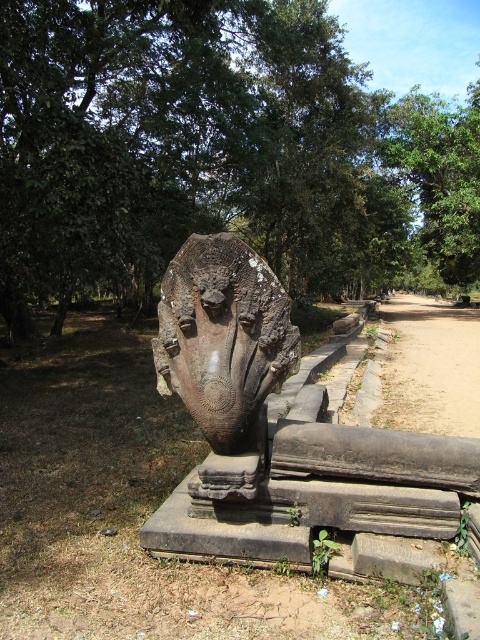
Question: Considering the relative positions of green rough stone tree at upper center and green leafy tree at upper center in the image provided, where is green rough stone tree at upper center located with respect to green leafy tree at upper center?

Choices:
 (A) left
 (B) right

Answer: (A)

Question: Is rusty stone statue at center in front of rusty stone face at center?

Choices:
 (A) no
 (B) yes

Answer: (B)

Question: Estimate the real-world distances between objects in this image. Which object is farther from the green leafy tree at upper center?

Choices:
 (A) rusty stone face at center
 (B) rusty stone statue at center

Answer: (A)

Question: Does green rough stone tree at upper center appear over rusty stone face at center?

Choices:
 (A) no
 (B) yes

Answer: (B)

Question: Which point is farther to the camera?

Choices:
 (A) pos(261,380)
 (B) pos(399,150)

Answer: (B)

Question: Estimate the real-world distances between objects in this image. Which object is closer to the green rough stone tree at upper center?

Choices:
 (A) rusty stone statue at center
 (B) green leafy tree at upper center

Answer: (B)